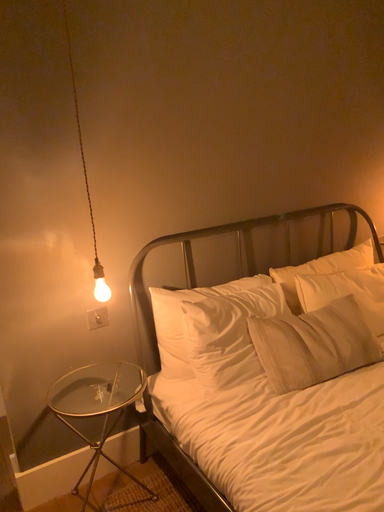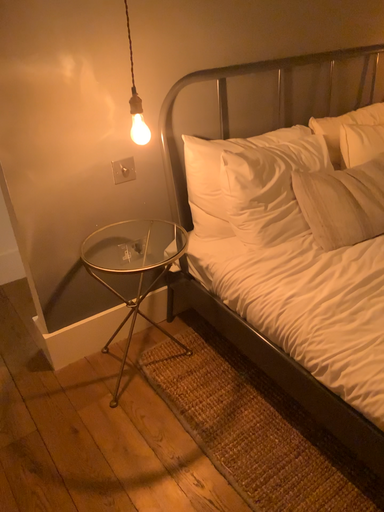
Question: How did the camera likely rotate when shooting the video?

Choices:
 (A) rotated upward
 (B) rotated downward

Answer: (B)